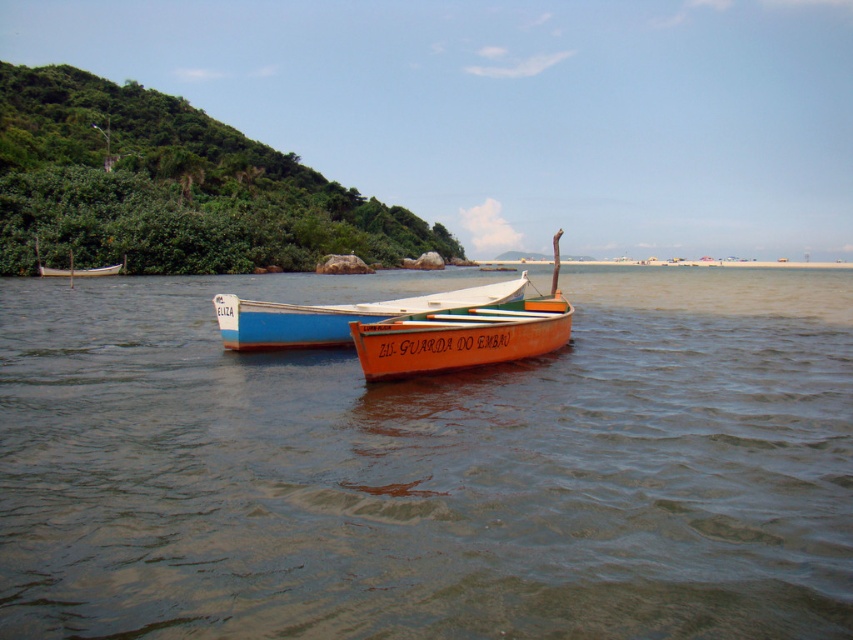
You are a photographer planning to capture the entire scene of the brown matte water at center and the blue painted wood boat at center in one shot. Based on their sizes, which object will occupy more of the frame?

The brown matte water at center will occupy more of the frame because its width is larger than the blue painted wood boat at center.

You are standing on the beach looking at the two boats in the water. The orange boat with black lettering is at point (x=328, y=333) and the white boat named ELIZA is at point (x=61, y=269). Which boat is closer to you?

The orange boat with black lettering at point (x=328, y=333) is closer to you because it is closer to the camera than point (x=61, y=269).

You are a lifeguard standing on a nearby pier and need to reach both the orange matte canoe at center and the white wooden boat at left to check safety equipment. Given that your maximum reach distance is 30 meters, can you safely reach both vessels without leaving the pier?

The orange matte canoe at center and the white wooden boat at left are 37.96 meters apart from each other. Since your maximum reach distance is 30 meters, you cannot safely reach both vessels without leaving the pier because the distance between them exceeds your reach capability.